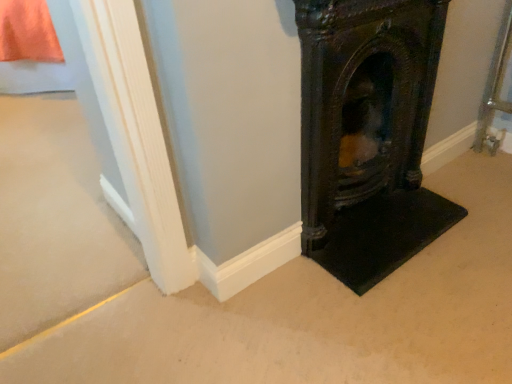
Identify the location of vacant location below dark brown cast iron fireplace at center (from a real-world perspective). (366, 209).